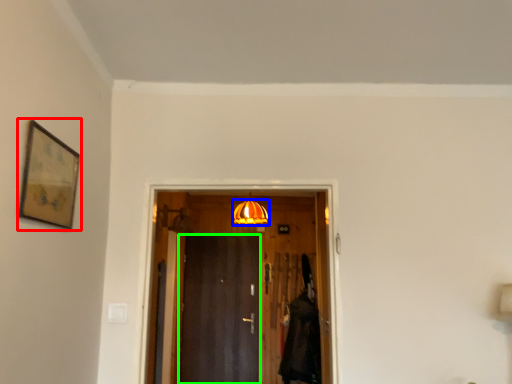
Question: Estimate the real-world distances between objects in this image. Which object is closer to picture frame (highlighted by a red box), lamp (highlighted by a blue box) or door (highlighted by a green box)?

Choices:
 (A) lamp
 (B) door

Answer: (B)